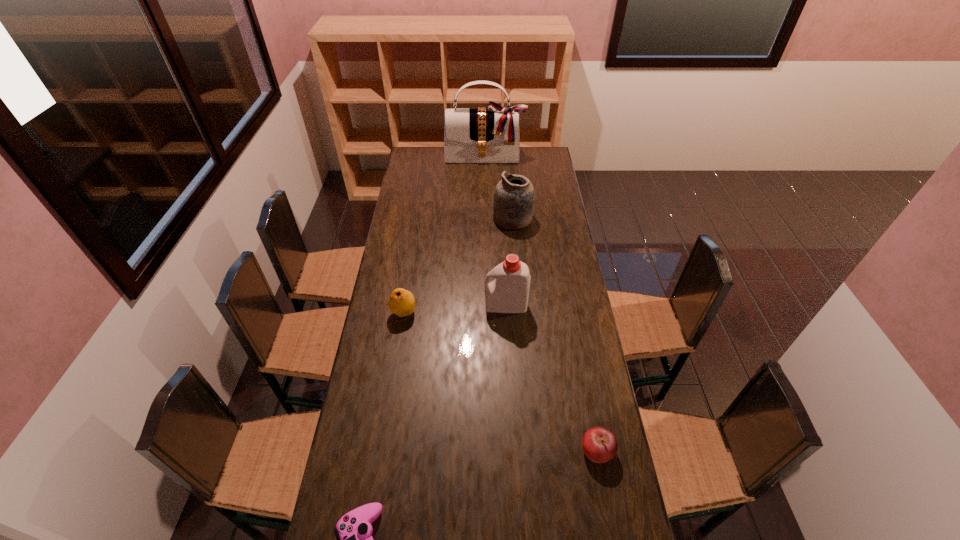
Locate an element on the screen. The height and width of the screenshot is (540, 960). free space at the far edge is located at coordinates (508, 164).

I want to click on vacant area at the left edge, so click(419, 192).

Where is `vacant area at the right edge of the desktop`? The image size is (960, 540). vacant area at the right edge of the desktop is located at coordinates (x=544, y=190).

Where is `vacant space at the far left corner`? This screenshot has height=540, width=960. vacant space at the far left corner is located at coordinates (415, 149).

I want to click on free space between the fifth nearest object and the apple, so click(x=555, y=334).

Where is `vacant space that is in between the fifth farthest object and the tallest object`? This screenshot has height=540, width=960. vacant space that is in between the fifth farthest object and the tallest object is located at coordinates (540, 303).

Identify the location of unoccupied area between the detergent and the satchel. The width and height of the screenshot is (960, 540). (495, 231).

Find the location of a particular element. Image resolution: width=960 pixels, height=540 pixels. vacant region between the farthest object and the detergent is located at coordinates (495, 231).

Identify which object is the second closest to the apple. Please provide its 2D coordinates. Your answer should be formatted as a tuple, i.e. [(x, y)], where the tuple contains the x and y coordinates of a point satisfying the conditions above.

[(353, 531)]

What are the coordinates of `object that is the fifth closest to the satchel` in the screenshot? It's located at (353, 531).